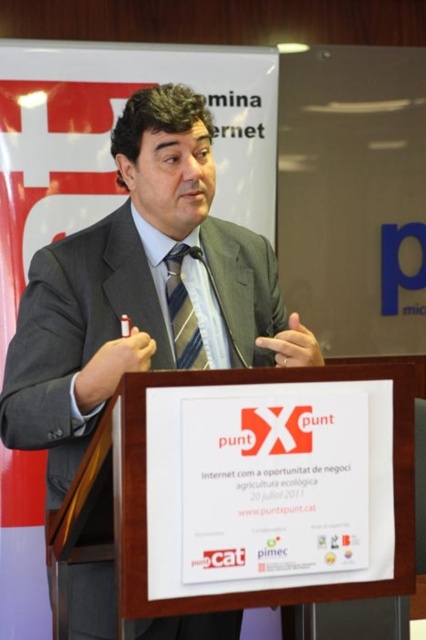
Can you confirm if gray suit at center is positioned to the left of striped fabric tie at center?

Correct, you'll find gray suit at center to the left of striped fabric tie at center.

What are the coordinates of `gray suit at center` in the screenshot? It's located at (140, 289).